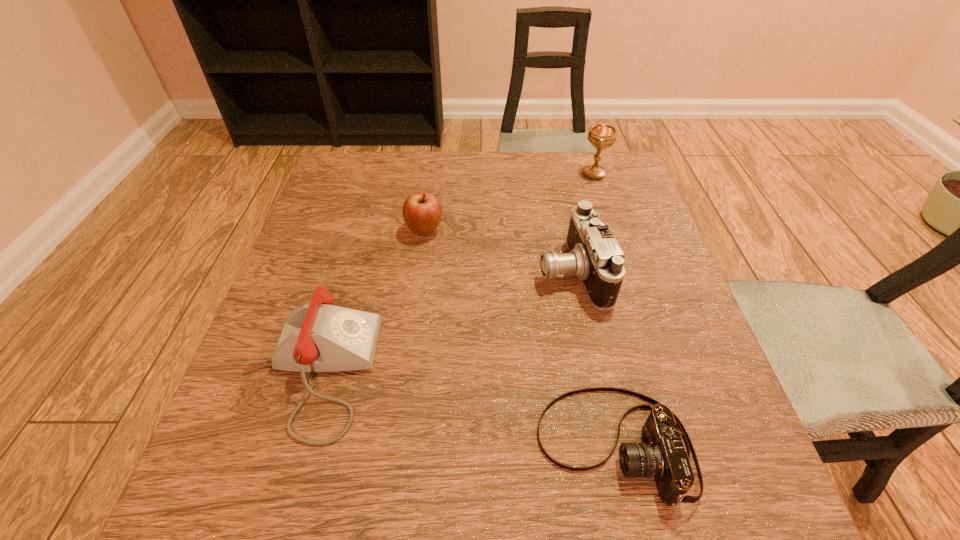
Locate an element on the screen. The image size is (960, 540). vacant area located at the lens of the farther camera is located at coordinates (412, 272).

Locate an element on the screen. vacant region located on the right of the fourth object from right to left is located at coordinates (558, 231).

Identify the location of vacant space situated on the dial of the fourth tallest object. (459, 371).

You are a GUI agent. You are given a task and a screenshot of the screen. Output one action in this format:
    pyautogui.click(x=<x>, y=<y>)
    Task: Click on the free location located 0.170m on the front-facing side of the nearer camera
    Image resolution: width=960 pixels, height=540 pixels.
    Given the screenshot: What is the action you would take?
    tap(428, 446)

Find the location of `free space located on the front-facing side of the nearer camera`. free space located on the front-facing side of the nearer camera is located at coordinates (435, 446).

Locate an element on the screen. This screenshot has height=540, width=960. blank area located on the front-facing side of the nearer camera is located at coordinates (312, 446).

Locate an element on the screen. object present at the far edge is located at coordinates (601, 136).

The width and height of the screenshot is (960, 540). Identify the location of object that is positioned at the near edge. (663, 456).

Where is `object located at the left edge`? This screenshot has width=960, height=540. object located at the left edge is located at coordinates (320, 337).

Where is `chalice located at the right edge`? chalice located at the right edge is located at coordinates (601, 136).